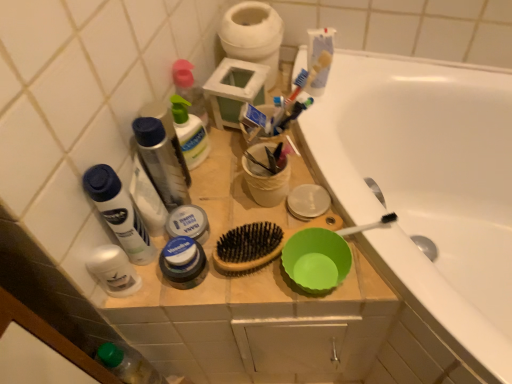
This screenshot has width=512, height=384. In order to click on vacant area located to the right-hand side of white plastic cup at center, placed as the third basin when sorted from bottom to top in this screenshot , I will do `click(322, 186)`.